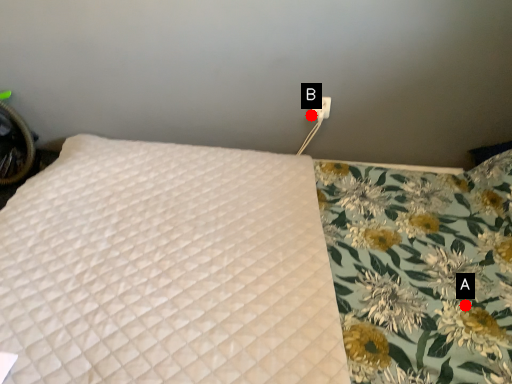
Question: Two points are circled on the image, labeled by A and B beside each circle. Among these points, which one is farthest from the camera?

Choices:
 (A) A is further
 (B) B is further

Answer: (B)